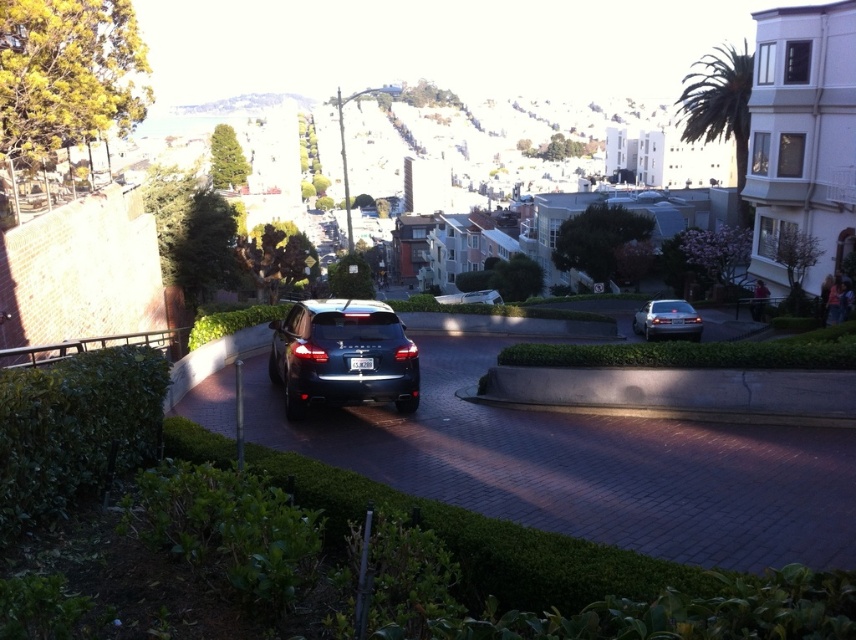
Question: Is satin black sedan at center above white plastic license plate at center?

Choices:
 (A) yes
 (B) no

Answer: (B)

Question: Which point is farther to the camera?

Choices:
 (A) white concrete buildings at upper center
 (B) satin black sedan at center
 (C) satin silver sedan at center

Answer: (A)

Question: Estimate the real-world distances between objects in this image. Which object is closer to the white plastic license plate at center?

Choices:
 (A) white concrete buildings at upper center
 (B) satin black sedan at center

Answer: (B)

Question: Does white concrete buildings at upper center have a smaller size compared to white plastic license plate at center?

Choices:
 (A) yes
 (B) no

Answer: (B)

Question: Is satin black sedan at center bigger than white plastic license plate at center?

Choices:
 (A) no
 (B) yes

Answer: (B)

Question: Which object appears closest to the camera in this image?

Choices:
 (A) satin silver sedan at center
 (B) white concrete buildings at upper center
 (C) white plastic license plate at center
 (D) satin black sedan at center

Answer: (D)